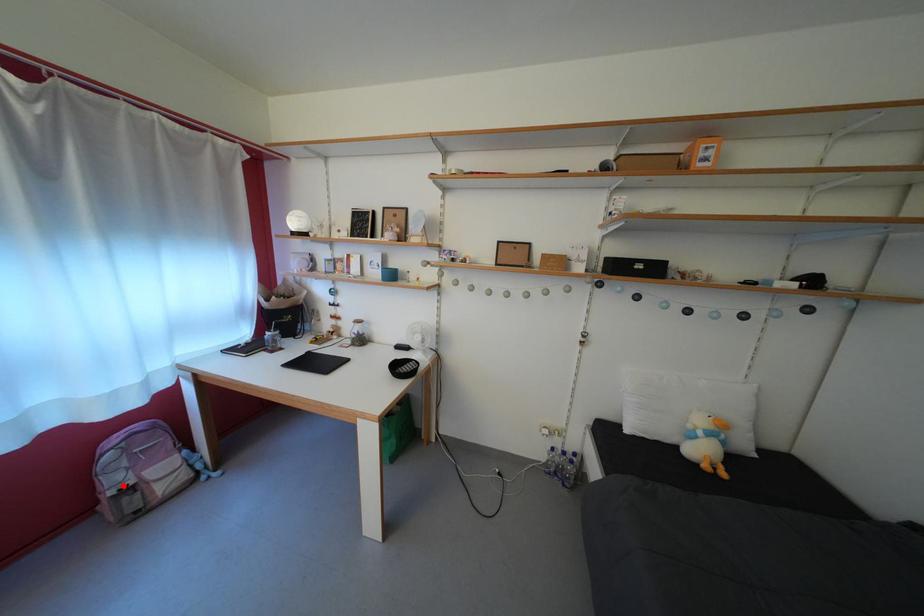
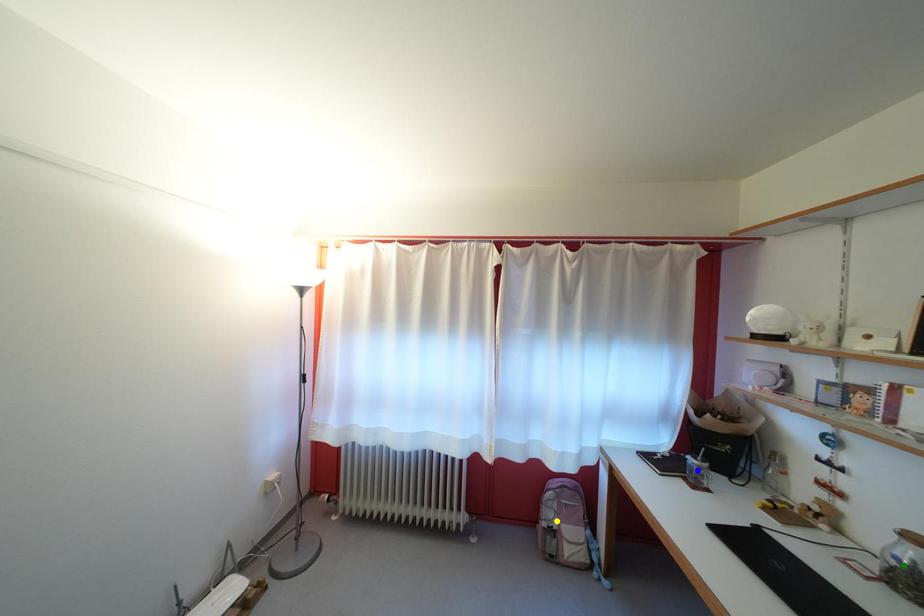
Question: I am providing you with two images of the same scene from different viewpoints. A red point is marked on the first image. You are given multiple points on the second image. Which mark in image 2 goes with the point in image 1?

Choices:
 (A) green point
 (B) blue point
 (C) yellow point

Answer: (C)